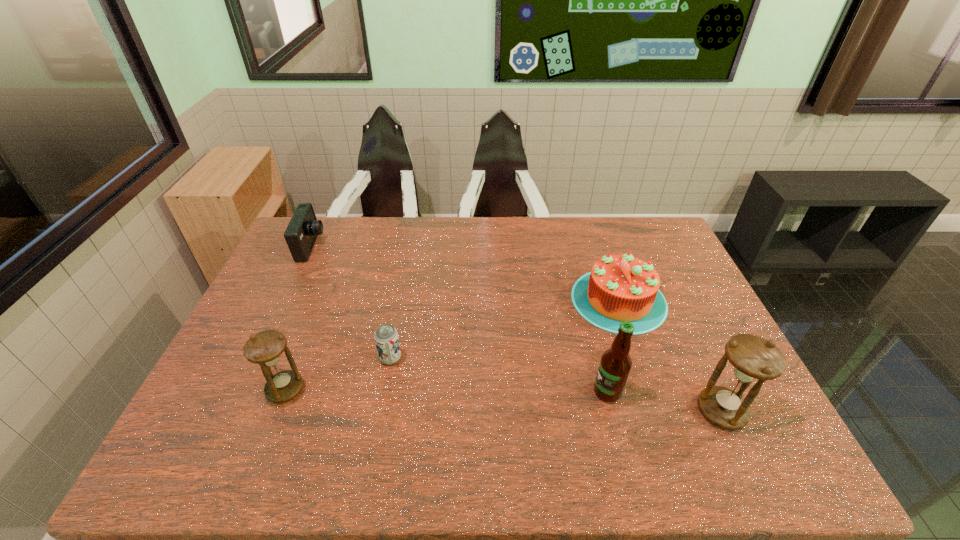
If the aim is uniform spacing by inserting an additional hourglass among them, please point to a vacant space for this new hourglass. Please provide its 2D coordinates. Your answer should be formatted as a tuple, i.e. [(x, y)], where the tuple contains the x and y coordinates of a point satisfying the conditions above.

[(499, 400)]